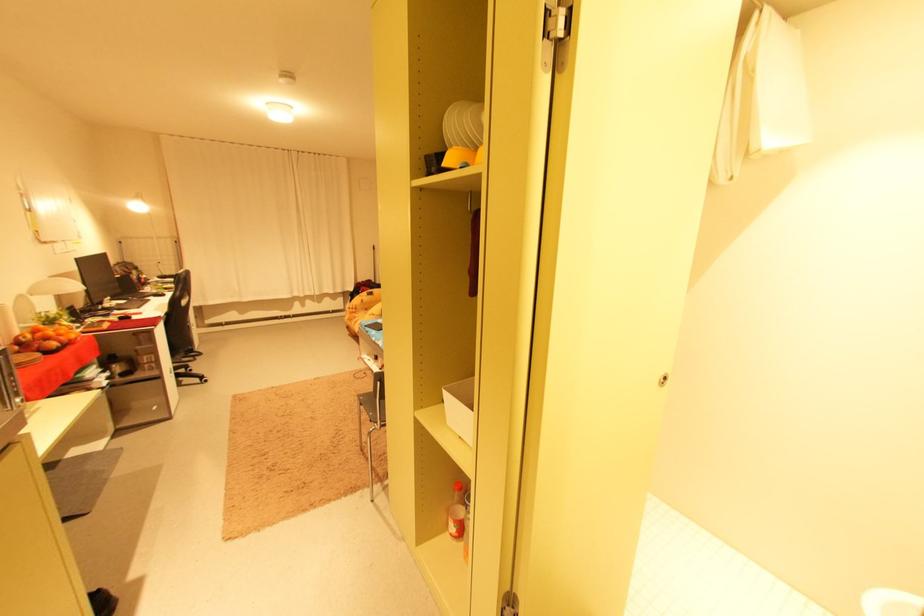
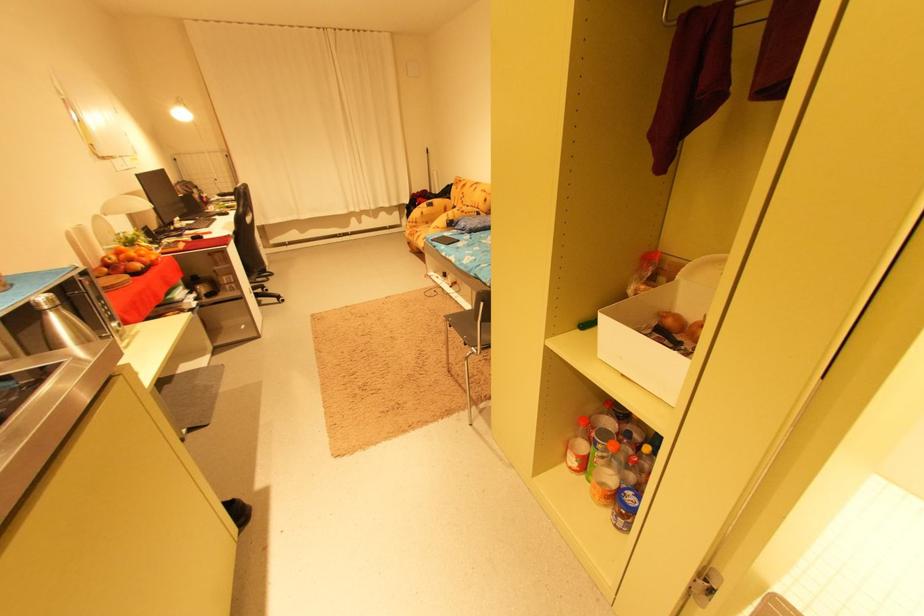
Locate, in the second image, the point that corresponds to (x=377, y=415) in the first image.

(469, 338)